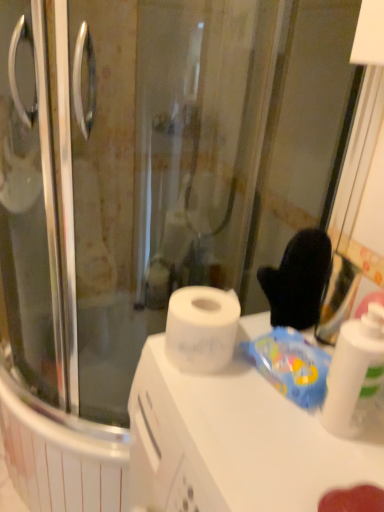
At what (x,y) coordinates should I click in order to perform the action: click on vacant area that is in front of blue plastic bag at upper right. Please return your answer as a coordinate pair (x, y). This screenshot has height=512, width=384. Looking at the image, I should click on (280, 445).